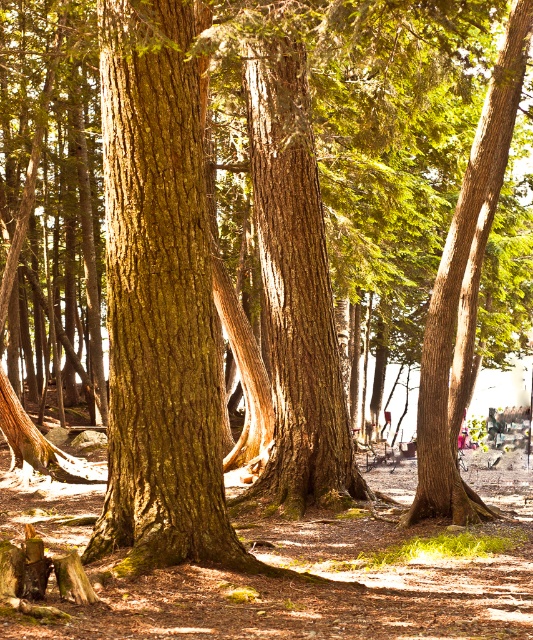
Question: Does green mossy bark tree trunk at center appear over brown rough bark tree trunk at center?

Choices:
 (A) yes
 (B) no

Answer: (B)

Question: Among these points, which one is nearest to the camera?

Choices:
 (A) click(x=465, y=179)
 (B) click(x=264, y=180)

Answer: (A)

Question: Among these points, which one is farthest from the camera?

Choices:
 (A) (423, 442)
 (B) (175, 451)

Answer: (A)

Question: Considering the relative positions of brown rough bark tree trunk at center and brown rough tree trunk at center in the image provided, where is brown rough bark tree trunk at center located with respect to brown rough tree trunk at center?

Choices:
 (A) below
 (B) above

Answer: (B)

Question: Considering the real-world distances, which object is closest to the brown rough tree trunk at center?

Choices:
 (A) green mossy bark tree trunk at center
 (B) brown rough bark tree trunk at center

Answer: (B)

Question: Is brown rough bark tree trunk at center thinner than brown rough tree trunk at center?

Choices:
 (A) no
 (B) yes

Answer: (A)